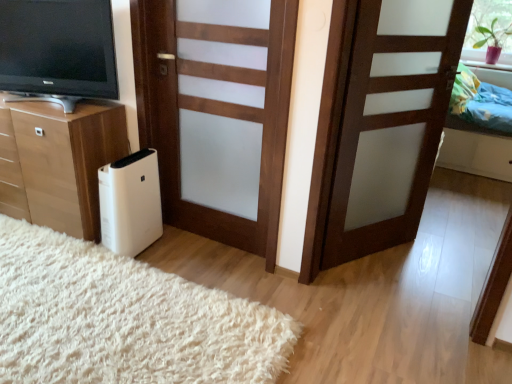
At what (x,y) coordinates should I click in order to perform the action: click on free point below matte black television at left (from a real-world perspective). Please return your answer as a coordinate pair (x, y). Looking at the image, I should click on (66, 108).